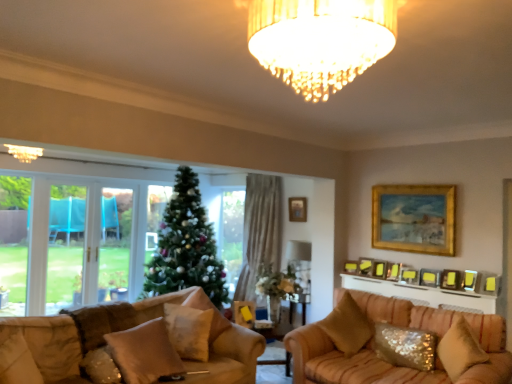
What are the coordinates of `free space above gold-framed painting at upper right, which is the 7th picture frame from back to front (from a real-world perspective)` in the screenshot? It's located at pyautogui.click(x=411, y=187).